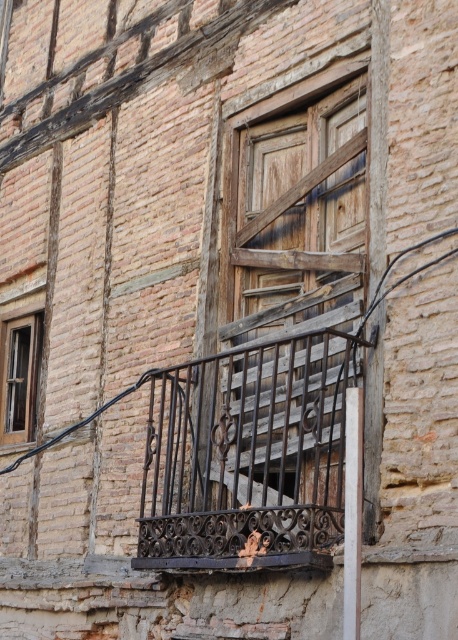
Is point (279, 394) behind point (34, 372)?

No, it is in front of (34, 372).

Is rusty wrought iron balustrade at center thinner than wooden window at left?

No.

Find the location of a particular element. The image size is (458, 640). rusty wrought iron balustrade at center is located at coordinates (247, 456).

Locate an element on the screen. This screenshot has width=458, height=640. rusty wrought iron balustrade at center is located at coordinates (247, 456).